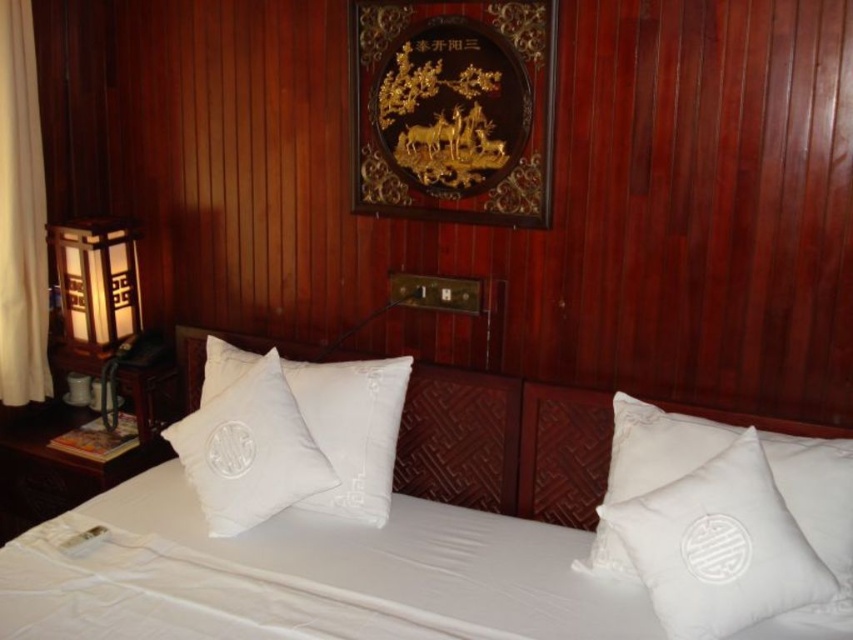
Does white quilted pillow at center come behind matte wooden lamp at left?

No, white quilted pillow at center is closer to the viewer.

Does white quilted pillow at center have a smaller size compared to matte wooden lamp at left?

Incorrect, white quilted pillow at center is not smaller in size than matte wooden lamp at left.

Is point (296, 384) positioned before point (114, 403)?

Yes, it is.

Where is `white quilted pillow at center`? The image size is (853, 640). white quilted pillow at center is located at coordinates (352, 429).

Which is in front, point (654, 445) or point (19, 237)?

Point (654, 445) is in front.

Can you confirm if white soft pillow at lower right is positioned below white fabric curtain at left?

Correct, white soft pillow at lower right is located below white fabric curtain at left.

Does point (616, 548) come behind point (12, 60)?

No, (616, 548) is closer to viewer.

Locate an element on the screen. This screenshot has width=853, height=640. white soft pillow at lower right is located at coordinates (817, 493).

Is white soft pillows at center shorter than white quilted pillow at center?

Indeed, white soft pillows at center has a lesser height compared to white quilted pillow at center.

Which is behind, point (154, 593) or point (399, 392)?

Point (399, 392)

Find the location of `white soft pillows at center`. white soft pillows at center is located at coordinates (306, 577).

Locate an element on the screen. white soft pillows at center is located at coordinates (306, 577).